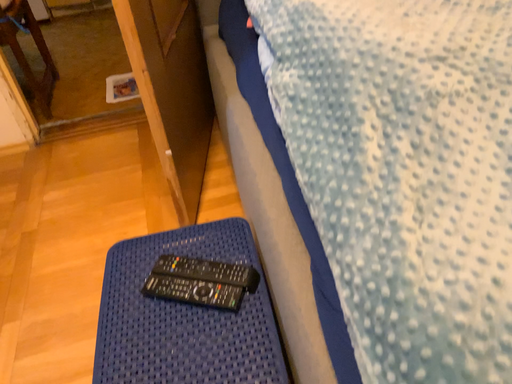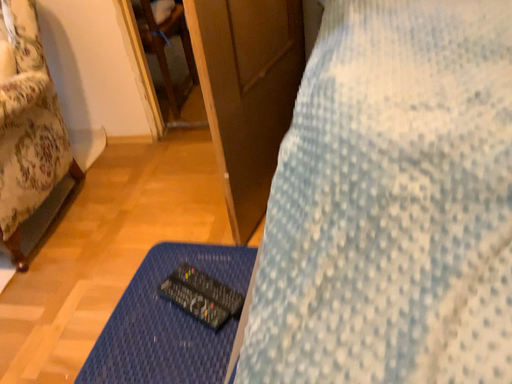
Question: Which way did the camera rotate in the video?

Choices:
 (A) rotated right
 (B) rotated left

Answer: (B)